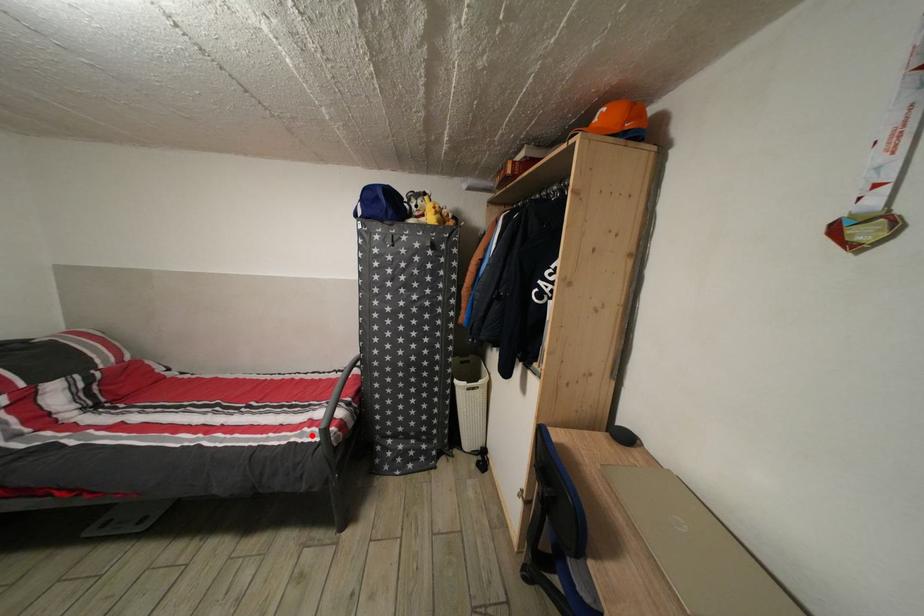
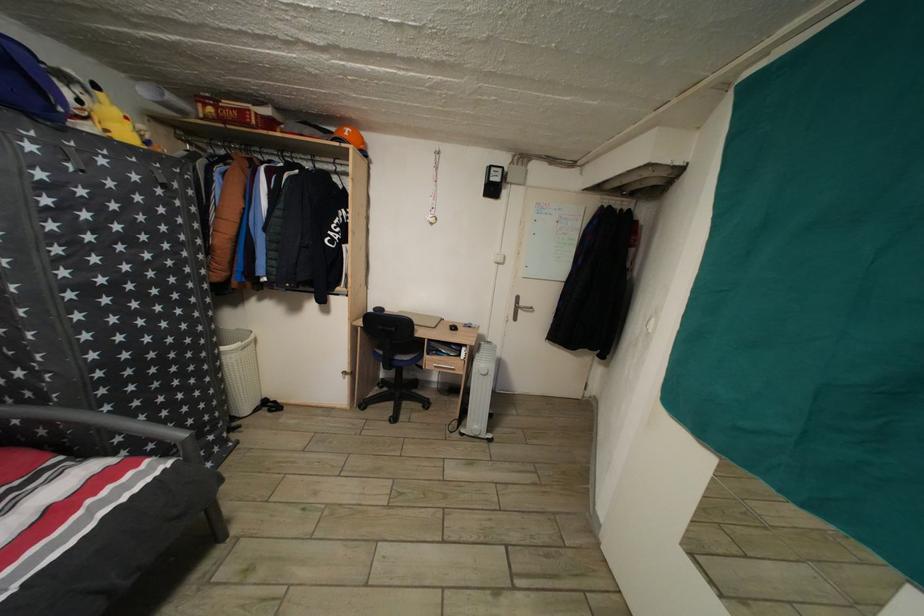
The point at the highlighted location is marked in the first image. Where is the corresponding point in the second image?

(96, 508)